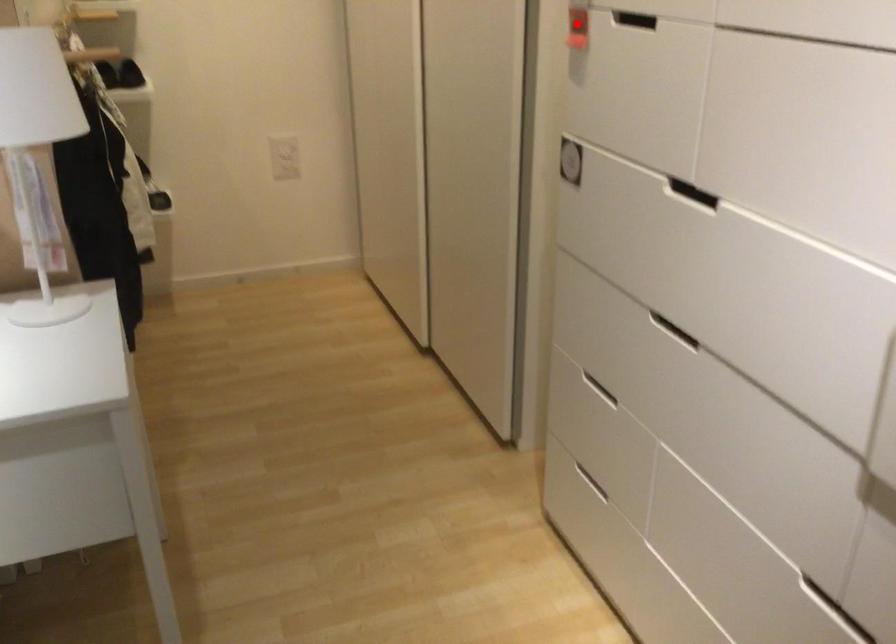
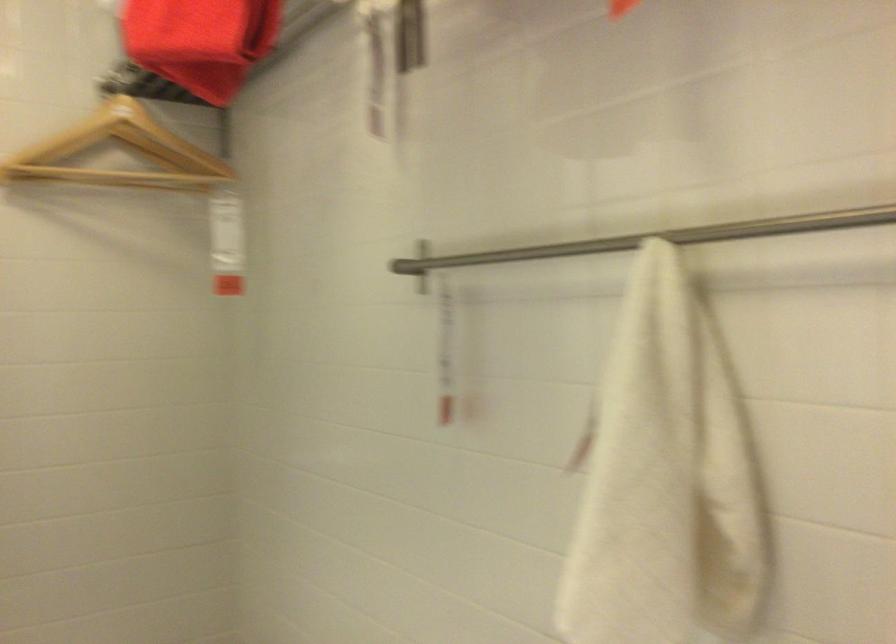
Question: I am providing you with two images of the same scene from different viewpoints. A red point is marked on the first image. Is the red point's position out of view in image 2?

Choices:
 (A) Yes
 (B) No

Answer: (A)